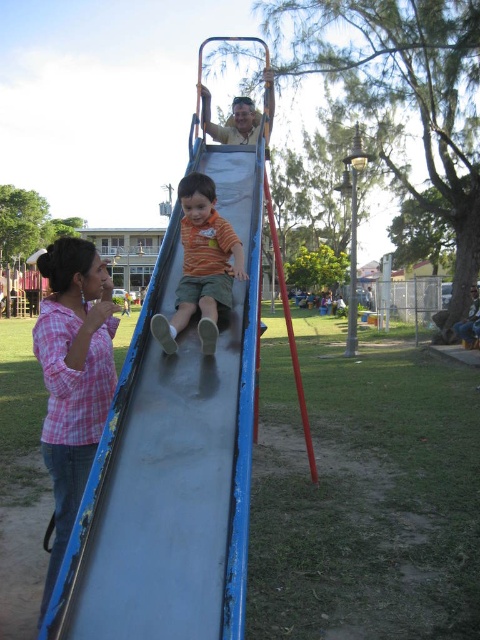
Which of these two, orange cotton shirt at center or smooth wooden slide at upper center, stands shorter?

With less height is orange cotton shirt at center.

Between orange cotton shirt at center and smooth wooden slide at upper center, which one appears on the right side from the viewer's perspective?

smooth wooden slide at upper center is more to the right.

Find the location of a particular element. orange cotton shirt at center is located at coordinates (202, 266).

Where is `orange cotton shirt at center`? The image size is (480, 640). orange cotton shirt at center is located at coordinates click(202, 266).

Is blue painted wood slide at center to the left of blue jeans at lower right from the viewer's perspective?

Indeed, blue painted wood slide at center is positioned on the left side of blue jeans at lower right.

Does blue painted wood slide at center appear over blue jeans at lower right?

No.

This screenshot has width=480, height=640. What do you see at coordinates (171, 461) in the screenshot?
I see `blue painted wood slide at center` at bounding box center [171, 461].

At what (x,y) coordinates should I click in order to perform the action: click on blue painted wood slide at center. Please return your answer as a coordinate pair (x, y). Image resolution: width=480 pixels, height=640 pixels. Looking at the image, I should click on (171, 461).

Which of these two, orange cotton shirt at center or blue jeans at lower right, stands shorter?

orange cotton shirt at center is shorter.

Can you confirm if orange cotton shirt at center is positioned above blue jeans at lower right?

Yes, orange cotton shirt at center is above blue jeans at lower right.

Is point (160, 321) positioned before point (476, 294)?

Yes, it is.

What are the coordinates of `orange cotton shirt at center` in the screenshot? It's located at (202, 266).